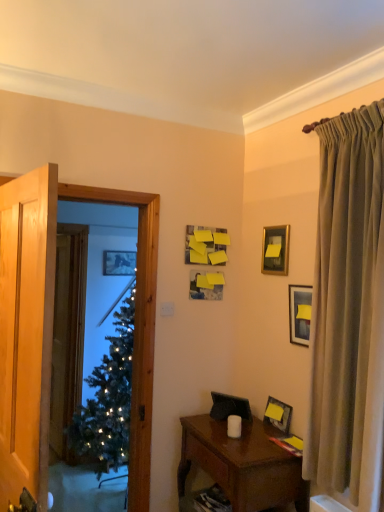
Question: From a real-world perspective, is brown wooden nightstand at lower right located higher than matte black picture frame at right, acting as the third picture frame starting from the left?

Choices:
 (A) no
 (B) yes

Answer: (A)

Question: Is brown wooden nightstand at lower right turned away from matte black picture frame at right, the 4th picture frame in the back-to-front sequence?

Choices:
 (A) no
 (B) yes

Answer: (A)

Question: Considering the relative positions of brown wooden nightstand at lower right and matte black picture frame at right, placed as the 1th picture frame when sorted from bottom to top, in the image provided, is brown wooden nightstand at lower right to the left of matte black picture frame at right, placed as the 1th picture frame when sorted from bottom to top, from the viewer's perspective?

Choices:
 (A) yes
 (B) no

Answer: (A)

Question: Is brown wooden nightstand at lower right thinner than matte black picture frame at right, placed as the 1th picture frame when sorted from bottom to top?

Choices:
 (A) no
 (B) yes

Answer: (A)

Question: Considering the relative sizes of brown wooden nightstand at lower right and matte black picture frame at right, the 4th picture frame in the back-to-front sequence, in the image provided, is brown wooden nightstand at lower right smaller than matte black picture frame at right, the 4th picture frame in the back-to-front sequence,?

Choices:
 (A) yes
 (B) no

Answer: (B)

Question: From the image's perspective, is brown wooden nightstand at lower right on top of matte black picture frame at right, positioned as the fifth picture frame in top-to-bottom order?

Choices:
 (A) no
 (B) yes

Answer: (A)

Question: From a real-world perspective, is metallic silver picture frame at upper left, placed as the first picture frame when sorted from back to front, positioned under brown wooden nightstand at lower right based on gravity?

Choices:
 (A) yes
 (B) no

Answer: (B)

Question: Does metallic silver picture frame at upper left, placed as the first picture frame when sorted from back to front, have a lesser width compared to brown wooden nightstand at lower right?

Choices:
 (A) no
 (B) yes

Answer: (B)

Question: Does metallic silver picture frame at upper left, the fifth picture frame in the right-to-left sequence, have a greater height compared to brown wooden nightstand at lower right?

Choices:
 (A) no
 (B) yes

Answer: (A)

Question: Does metallic silver picture frame at upper left, which is the 2th picture frame in top-to-bottom order, have a larger size compared to brown wooden nightstand at lower right?

Choices:
 (A) yes
 (B) no

Answer: (B)

Question: Does metallic silver picture frame at upper left, arranged as the first picture frame when viewed from the left, have a greater width compared to brown wooden nightstand at lower right?

Choices:
 (A) no
 (B) yes

Answer: (A)

Question: From a real-world perspective, is metallic silver picture frame at upper left, arranged as the first picture frame when viewed from the left, positioned over brown wooden nightstand at lower right based on gravity?

Choices:
 (A) yes
 (B) no

Answer: (A)

Question: Is yellow matte picture frame at upper right, arranged as the first picture frame when viewed from the front, at the back of metallic silver picture frame at upper left, arranged as the first picture frame when viewed from the left?

Choices:
 (A) no
 (B) yes

Answer: (A)